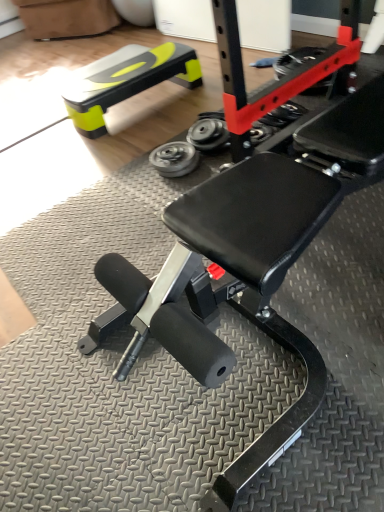
At what (x,y) coordinates should I click in order to perform the action: click on free space that is in between neon yellow plastic bench at upper left and metallic gray wheel at center, the 2th wheel viewed from the left. Please return your answer as a coordinate pair (x, y). The width and height of the screenshot is (384, 512). Looking at the image, I should click on (160, 122).